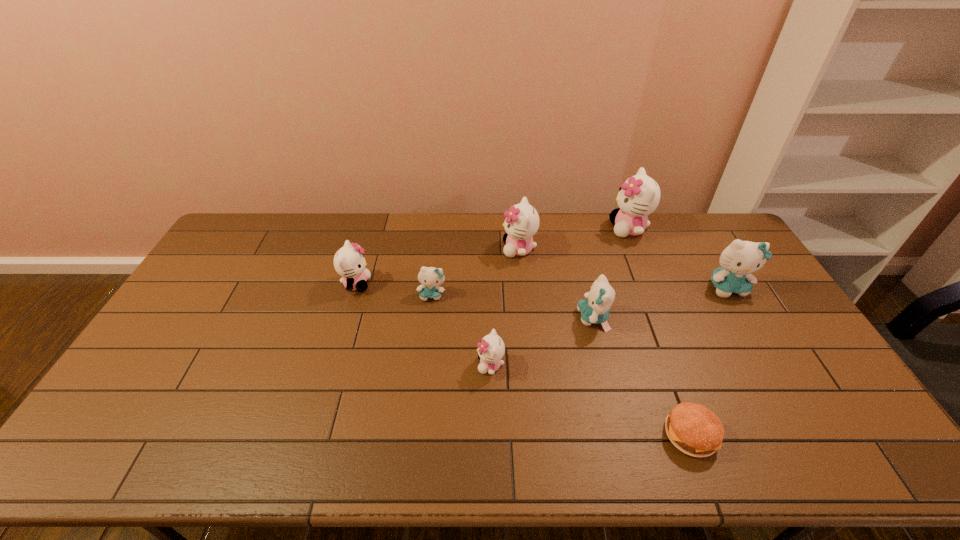
At what (x,y) coordinates should I click in order to perform the action: click on vacant region located 0.080m on the front-facing side of the second white kitten from right to left. Please return your answer as a coordinate pair (x, y). The image size is (960, 540). Looking at the image, I should click on (480, 249).

Image resolution: width=960 pixels, height=540 pixels. In order to click on free space located 0.190m on the front-facing side of the second white kitten from right to left in this screenshot , I will do `click(449, 249)`.

You are a GUI agent. You are given a task and a screenshot of the screen. Output one action in this format:
    pyautogui.click(x=<x>, y=<y>)
    Task: Click on the vacant space located on the face of the rightmost blue kitten
    
    Given the screenshot: What is the action you would take?
    pyautogui.click(x=802, y=414)

Identify the location of vacant space located on the face of the third kitten from right to left. The height and width of the screenshot is (540, 960). (448, 318).

Find the location of a particular element. vacant space situated 0.340m on the face of the third kitten from right to left is located at coordinates (468, 318).

You are a GUI agent. You are given a task and a screenshot of the screen. Output one action in this format:
    pyautogui.click(x=<x>, y=<y>)
    Task: Click on the vacant region located 0.160m on the face of the third kitten from right to left
    The width and height of the screenshot is (960, 540).
    Given the screenshot: What is the action you would take?
    pyautogui.click(x=526, y=318)

In order to click on vacant area situated on the front-facing side of the leftmost white kitten in this screenshot , I will do `click(449, 284)`.

I want to click on vacant space located 0.280m on the front-facing side of the third object from left to right, so coord(377,365).

The width and height of the screenshot is (960, 540). What are the coordinates of `free space located on the front-facing side of the third object from left to right` in the screenshot? It's located at (398, 365).

Where is `vacant space located 0.400m on the front-facing side of the third object from left to right`? Image resolution: width=960 pixels, height=540 pixels. vacant space located 0.400m on the front-facing side of the third object from left to right is located at coordinates (334, 365).